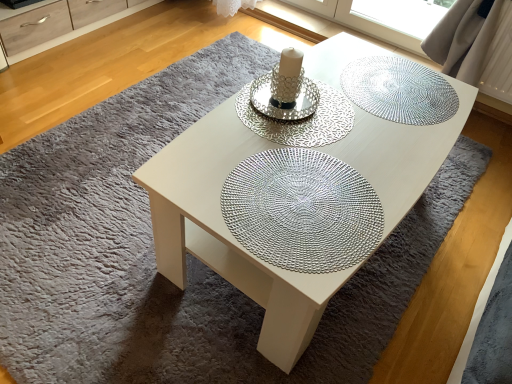
You are a GUI agent. You are given a task and a screenshot of the screen. Output one action in this format:
    pyautogui.click(x=<x>, y=<y>)
    Task: Click on the vacant area that lies between silver textured doily at center, positioned as the 3th glass plate in back-to-front order, and silver metallic doily at center, the 2th glass plate in the back-to-front sequence
    The width and height of the screenshot is (512, 384).
    Given the screenshot: What is the action you would take?
    point(304,148)